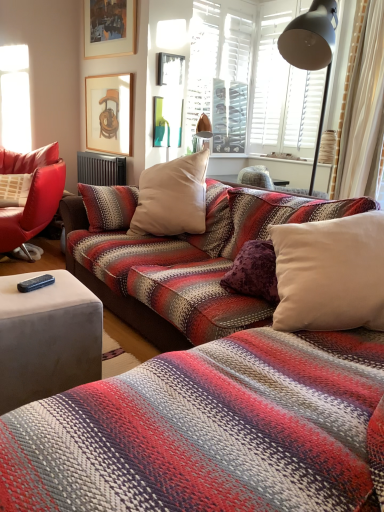
Where is `empty space that is ontop of velvet gray studio couch at lower left (from a real-world perspective)`? The height and width of the screenshot is (512, 384). empty space that is ontop of velvet gray studio couch at lower left (from a real-world perspective) is located at coordinates tap(46, 282).